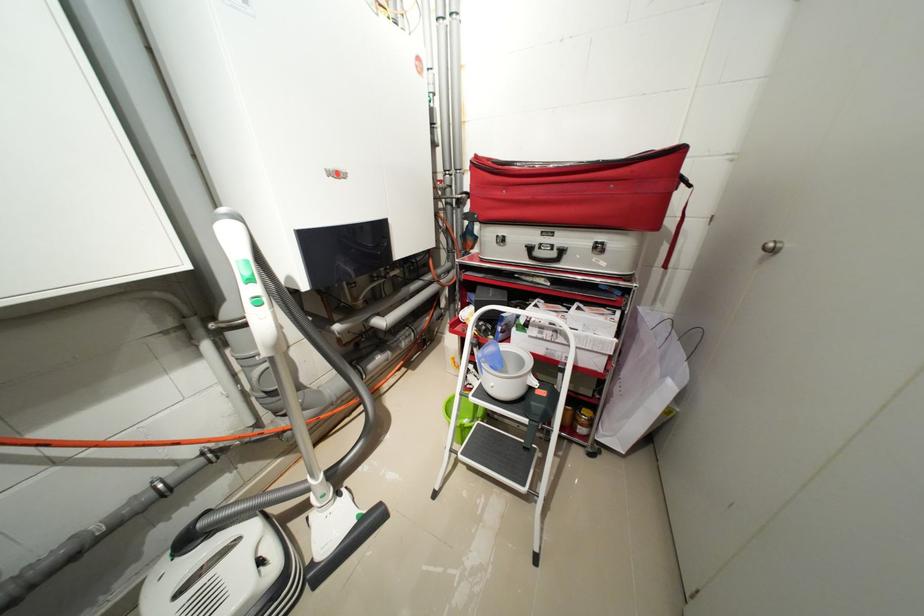
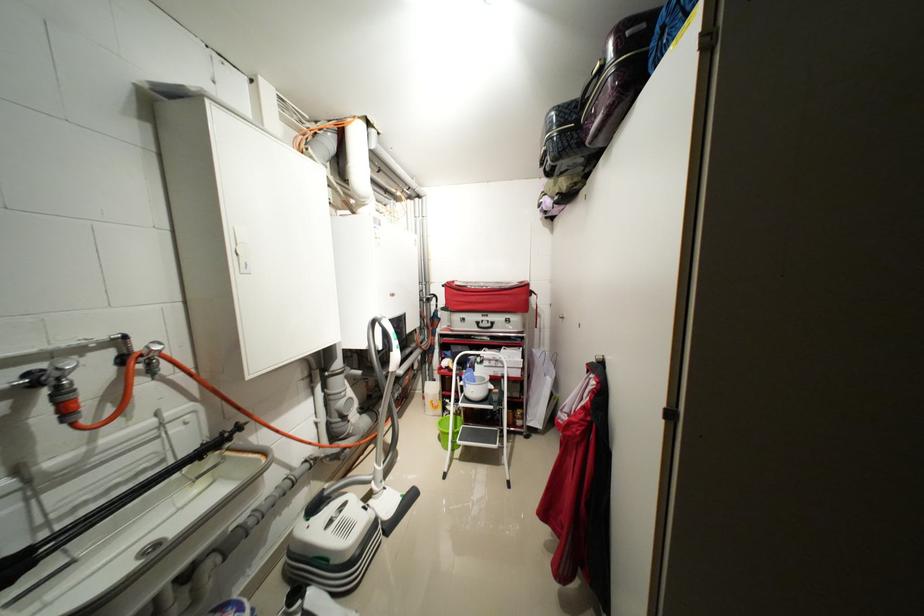
Locate, in the second image, the point that corresponds to point (483, 158) in the first image.

(455, 284)